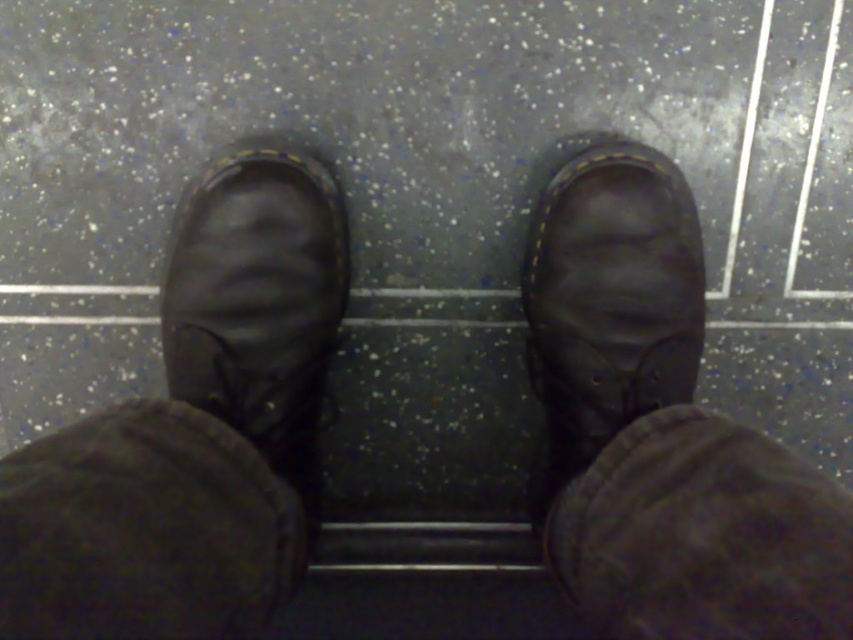
You are trying to find a missing sock in the room. You see the matte black shoe at center and the matte black shoe at right. Which shoe is closer to the floor?

The matte black shoe at center is positioned under the matte black shoe at right, so the matte black shoe at center is closer to the floor.